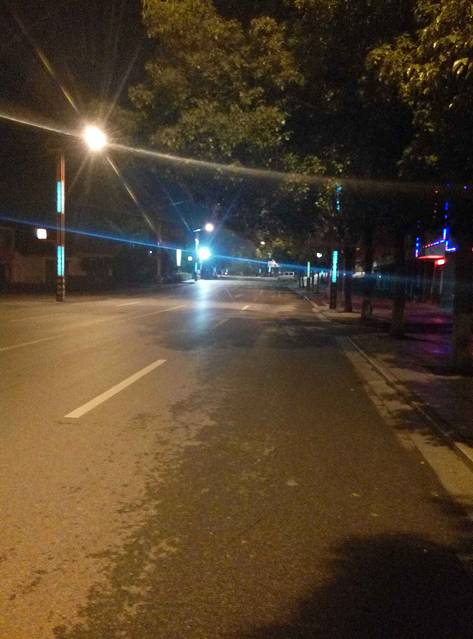
Identify the location of lights. (94, 137), (202, 254), (210, 225), (434, 252).